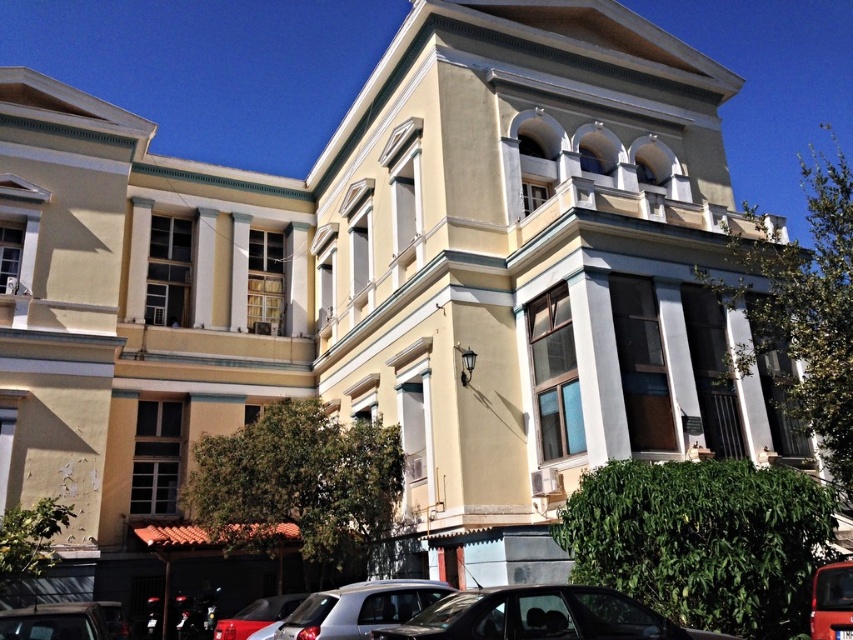
Question: Considering the real-world distances, which object is farthest from the shiny red car at lower center?

Choices:
 (A) matte red bus at lower right
 (B) silver metallic car at lower center
 (C) shiny black car at lower right
 (D) metallic silver car at lower left

Answer: (A)

Question: Where is shiny black car at lower right located in relation to metallic silver car at lower left in the image?

Choices:
 (A) right
 (B) left

Answer: (A)

Question: Which point is closer to the camera taking this photo?

Choices:
 (A) (339, 634)
 (B) (827, 570)
 (C) (624, 632)

Answer: (C)

Question: Where is shiny black car at lower right located in relation to matte red bus at lower right in the image?

Choices:
 (A) below
 (B) above

Answer: (B)

Question: Which of the following is the farthest from the observer?

Choices:
 (A) shiny red car at lower center
 (B) metallic silver car at lower left
 (C) shiny black car at lower right
 (D) matte red bus at lower right

Answer: (A)

Question: Is metallic silver car at lower left smaller than matte red bus at lower right?

Choices:
 (A) yes
 (B) no

Answer: (B)